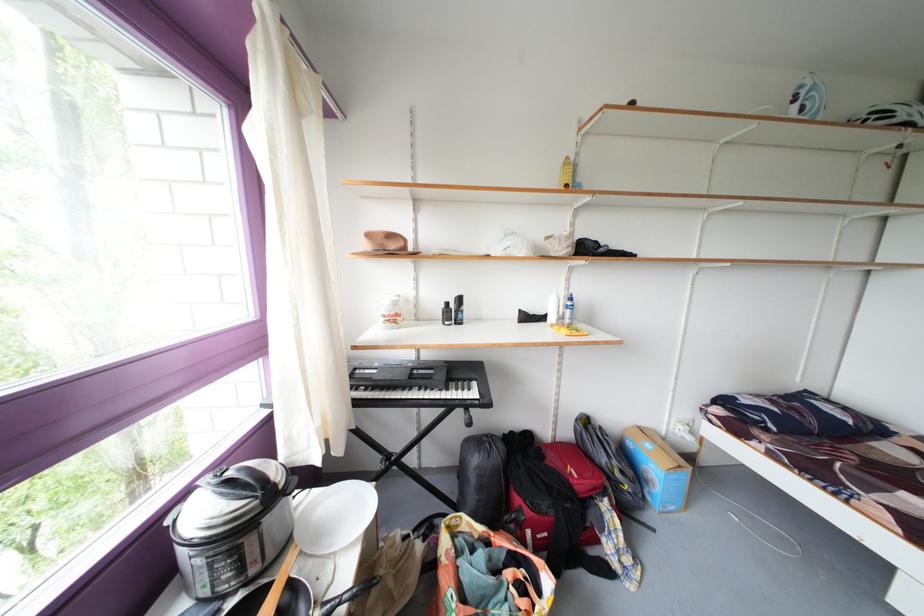
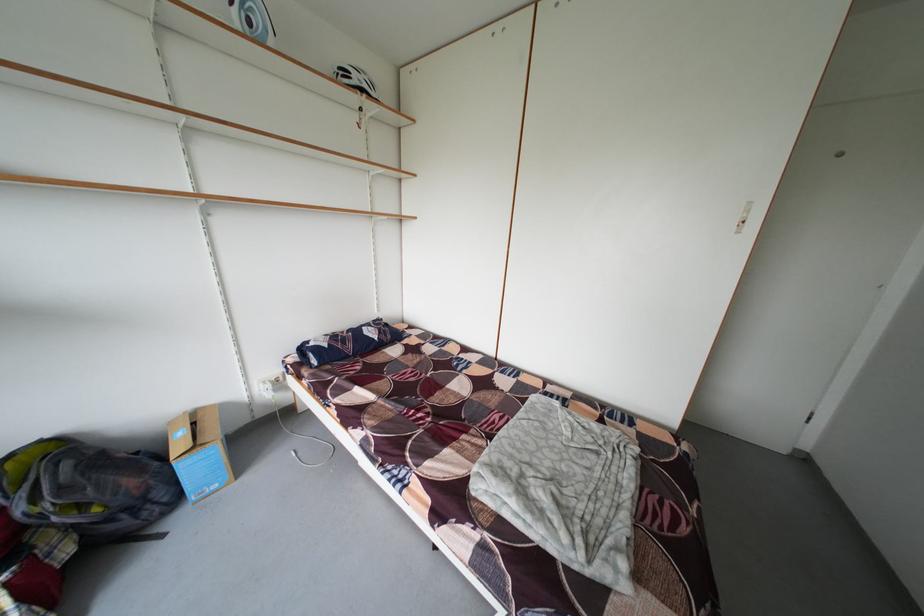
Locate, in the second image, the point that corresponds to pixel 684 426 in the first image.

(265, 387)